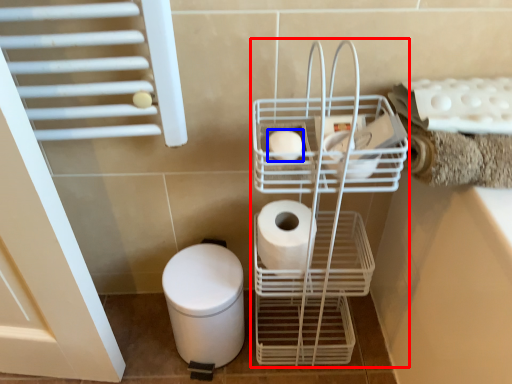
Question: Which of the following is the closest to the observer, trolley (highlighted by a red box) or toilet paper (highlighted by a blue box)?

Choices:
 (A) trolley
 (B) toilet paper

Answer: (A)